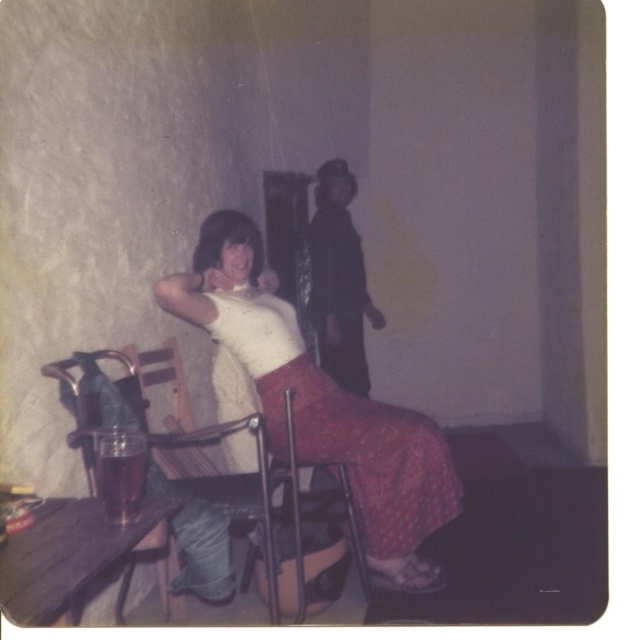
Question: Can you confirm if wooden chair at lower left is positioned below wooden table at lower left?

Choices:
 (A) no
 (B) yes

Answer: (A)

Question: Considering the real-world distances, which object is farthest from the wooden chair at lower left?

Choices:
 (A) white matte tank top at center
 (B) dark gray fabric jacket at center
 (C) wooden table at lower left

Answer: (B)

Question: Among these points, which one is nearest to the camera?

Choices:
 (A) (72, 566)
 (B) (341, 378)
 (C) (391, 538)
 (D) (128, 372)

Answer: (A)

Question: Which object is farther from the camera taking this photo?

Choices:
 (A) dark gray fabric jacket at center
 (B) wooden table at lower left
 (C) wooden chair at lower left
 (D) white matte tank top at center

Answer: (A)

Question: Is the position of wooden chair at lower left less distant than that of wooden table at lower left?

Choices:
 (A) yes
 (B) no

Answer: (B)

Question: Is white matte tank top at center above wooden table at lower left?

Choices:
 (A) no
 (B) yes

Answer: (B)